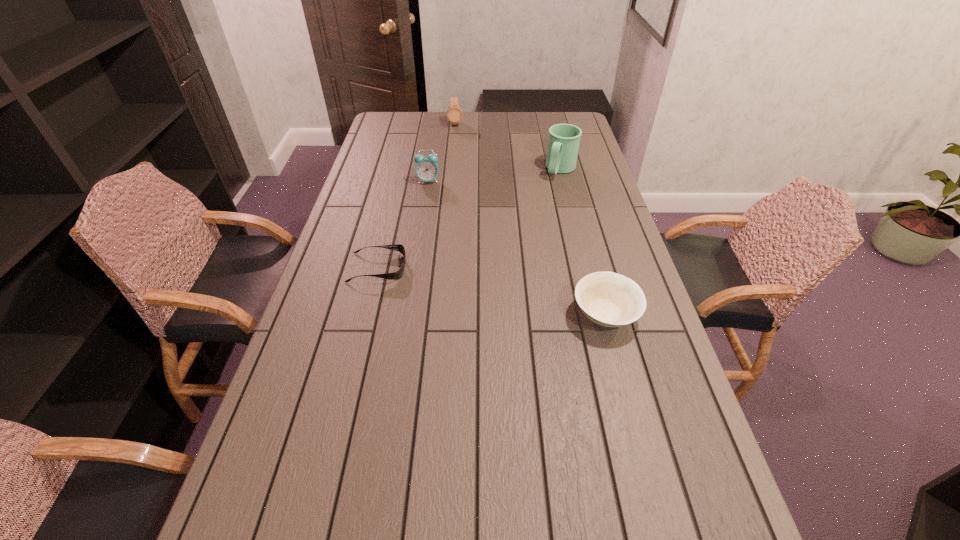
Identify the location of the fourth farthest object. (397, 275).

Find the location of `sunglasses`. sunglasses is located at coordinates (397, 275).

Identify the location of bowl. (609, 299).

Locate an element on the screen. Image resolution: width=960 pixels, height=540 pixels. the second shortest object is located at coordinates pos(609,299).

Find the location of a particular element. This screenshot has height=540, width=960. the third object from right to left is located at coordinates (454, 113).

This screenshot has height=540, width=960. What are the coordinates of `watch` in the screenshot? It's located at (454, 113).

Where is `alarm clock`? alarm clock is located at coordinates (426, 169).

Locate an element on the screen. The height and width of the screenshot is (540, 960). mug is located at coordinates (563, 143).

You are a GUI agent. You are given a task and a screenshot of the screen. Output one action in this format:
    pyautogui.click(x=<x>, y=<y>)
    Task: Click on the vacant point located 0.150m on the front-facing side of the fourth farthest object
    Image resolution: width=960 pixels, height=540 pixels.
    Given the screenshot: What is the action you would take?
    pyautogui.click(x=457, y=268)

What are the coordinates of `vacant area situated 0.240m on the back of the bowl` in the screenshot? It's located at (584, 237).